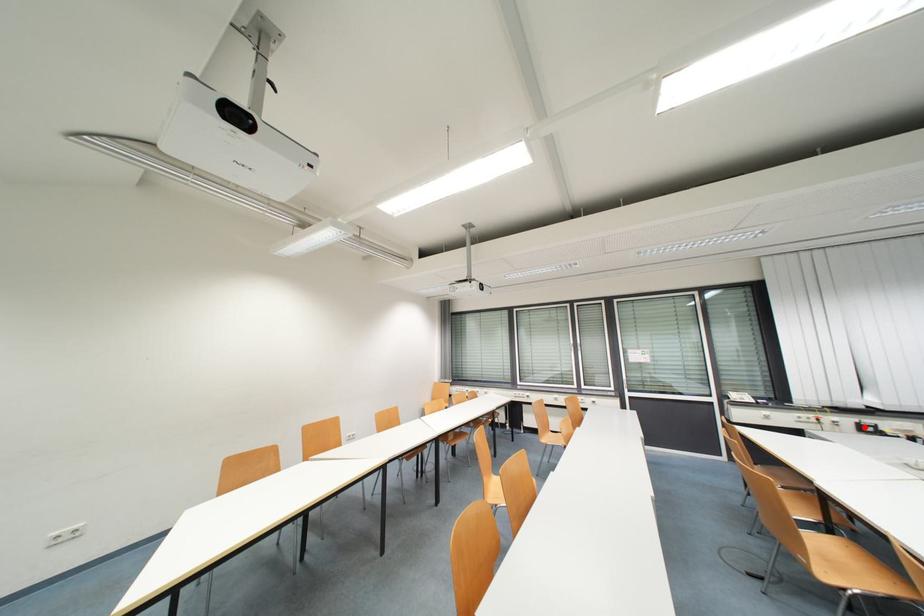
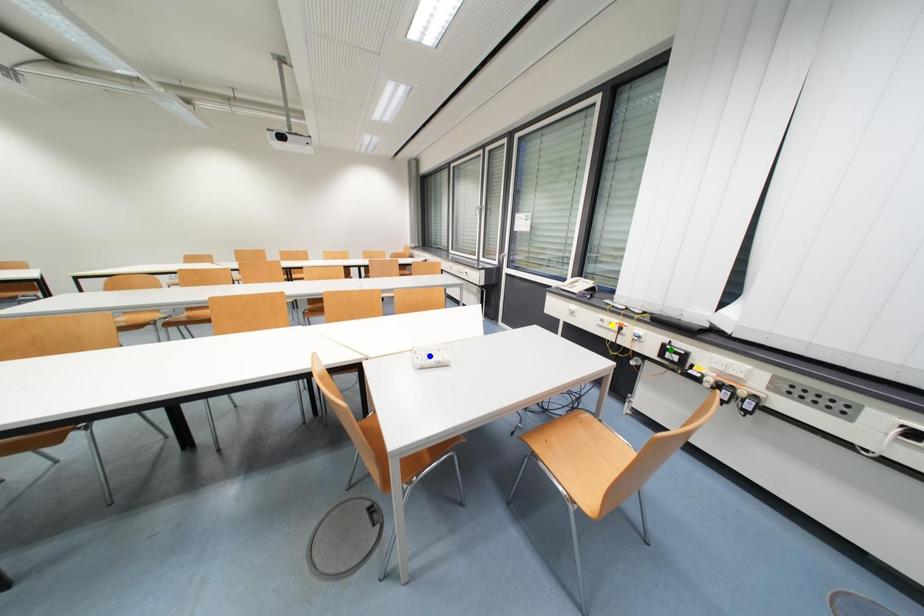
Question: I am providing you with two images of the same scene from different viewpoints. A red point is marked on the first image. You are given multiple points on the second image. Which spot in image 2 lines up with the point in image 1?

Choices:
 (A) blue point
 (B) yellow point
 (C) green point

Answer: (C)